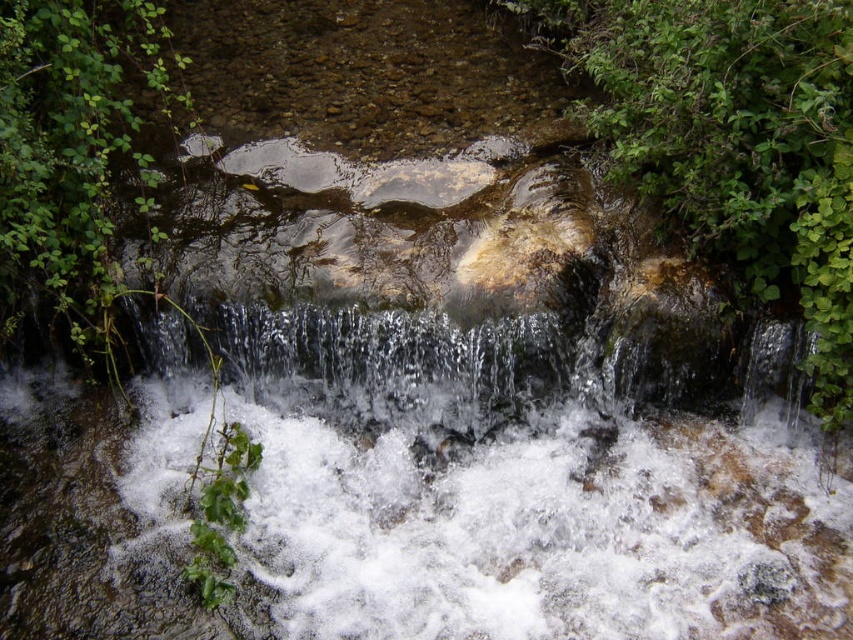
You are standing at the origin point of the coordinate system. Looking at the image, where is the green leafy plant at center right located in terms of coordinates?

The green leafy plant at center right is located at point coordinates of (734, 145).

You are standing near the water stream and see the green leafy plant at center right and the clear water at center. Which object is located higher in elevation?

The green leafy plant at center right is positioned over the clear water at center, so it is located higher in elevation.

You are standing at the edge of the stream and want to reach the point marked as point (821, 412). Given that your maximum comfortable walking distance is 3.5 meters, can you safely walk to that point without needing to swim?

The distance of point (821, 412) from camera is 3.68 meters, which exceeds your maximum comfortable walking distance of 3.5 meters. Therefore, you cannot safely walk to that point without needing to swim.